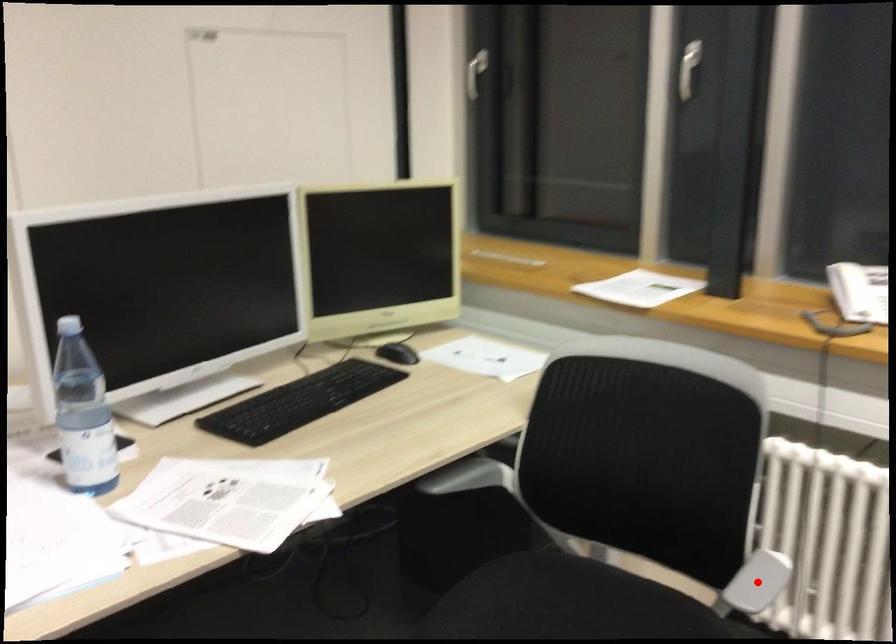
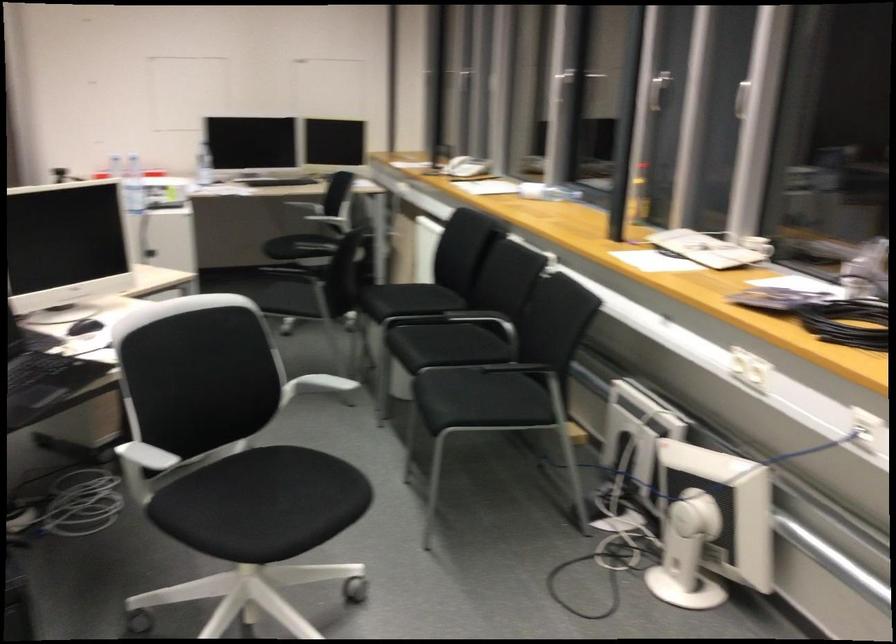
The point at the highlighted location is marked in the first image. Where is the corresponding point in the second image?

(323, 213)